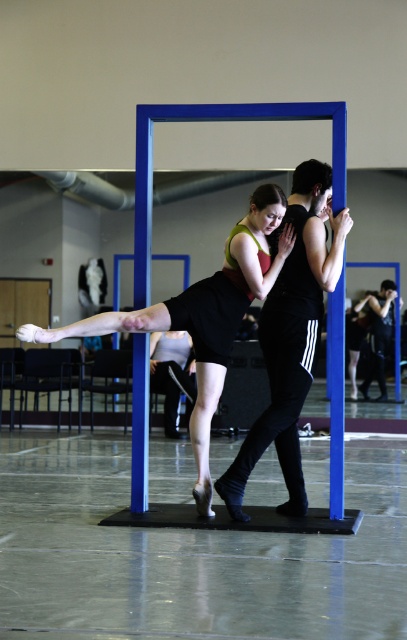
Consider the image. Can you confirm if black matte pants at center is smaller than black satin skirt at center?

Indeed, black matte pants at center has a smaller size compared to black satin skirt at center.

Who is more distant from viewer, (310, 344) or (205, 476)?

The point (205, 476) is more distant.

You are a GUI agent. You are given a task and a screenshot of the screen. Output one action in this format:
    pyautogui.click(x=<x>, y=<y>)
    Task: Click on the black matte pants at center
    
    Given the screenshot: What is the action you would take?
    pyautogui.click(x=291, y=337)

From the picture: Who is positioned more to the left, black matte pants at center or dark blue jeans at center?

black matte pants at center is more to the left.

Is black matte pants at center in front of dark blue jeans at center?

Yes, it is in front of dark blue jeans at center.

Locate an element on the screen. Image resolution: width=407 pixels, height=640 pixels. black matte pants at center is located at coordinates (291, 337).

In order to click on black matte pants at center in this screenshot , I will do [x=291, y=337].

Is black satin skirt at center to the right of dark blue jeans at center from the viewer's perspective?

Incorrect, black satin skirt at center is not on the right side of dark blue jeans at center.

What do you see at coordinates (205, 316) in the screenshot? I see `black satin skirt at center` at bounding box center [205, 316].

I want to click on black satin skirt at center, so click(205, 316).